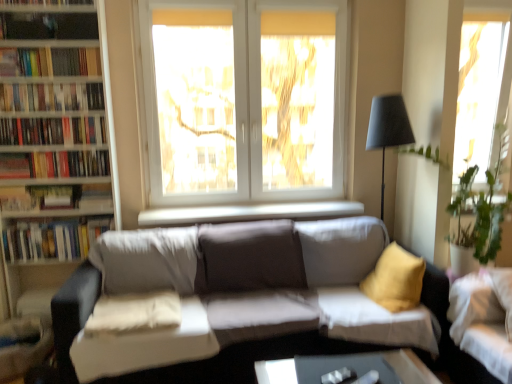
You are a GUI agent. You are given a task and a screenshot of the screen. Output one action in this format:
    pyautogui.click(x=<x>, y=<y>)
    Task: Click on the free space above hardcover books at left, the 4th book positioned from the bottom (from a real-world perspective)
    Image resolution: width=512 pixels, height=384 pixels.
    Given the screenshot: What is the action you would take?
    pyautogui.click(x=40, y=82)